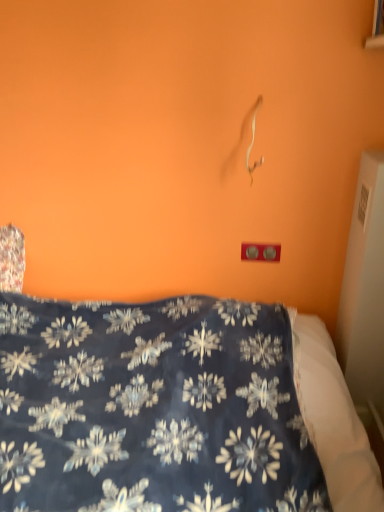
Question: Relative to matte plastic outlet at center, is dark blue fabric at center in front or behind?

Choices:
 (A) front
 (B) behind

Answer: (A)

Question: In terms of width, does dark blue fabric at center look wider or thinner when compared to matte plastic outlet at center?

Choices:
 (A) thin
 (B) wide

Answer: (B)

Question: Visually, is dark blue fabric at center positioned to the left or to the right of matte plastic outlet at center?

Choices:
 (A) right
 (B) left

Answer: (B)

Question: From their relative heights in the image, would you say matte plastic outlet at center is taller or shorter than dark blue fabric at center?

Choices:
 (A) short
 (B) tall

Answer: (A)

Question: Considering the positions of matte plastic outlet at center and dark blue fabric at center in the image, is matte plastic outlet at center wider or thinner than dark blue fabric at center?

Choices:
 (A) wide
 (B) thin

Answer: (B)

Question: In the image, is matte plastic outlet at center on the left side or the right side of dark blue fabric at center?

Choices:
 (A) right
 (B) left

Answer: (A)

Question: Considering their positions, is matte plastic outlet at center located in front of or behind dark blue fabric at center?

Choices:
 (A) behind
 (B) front

Answer: (A)